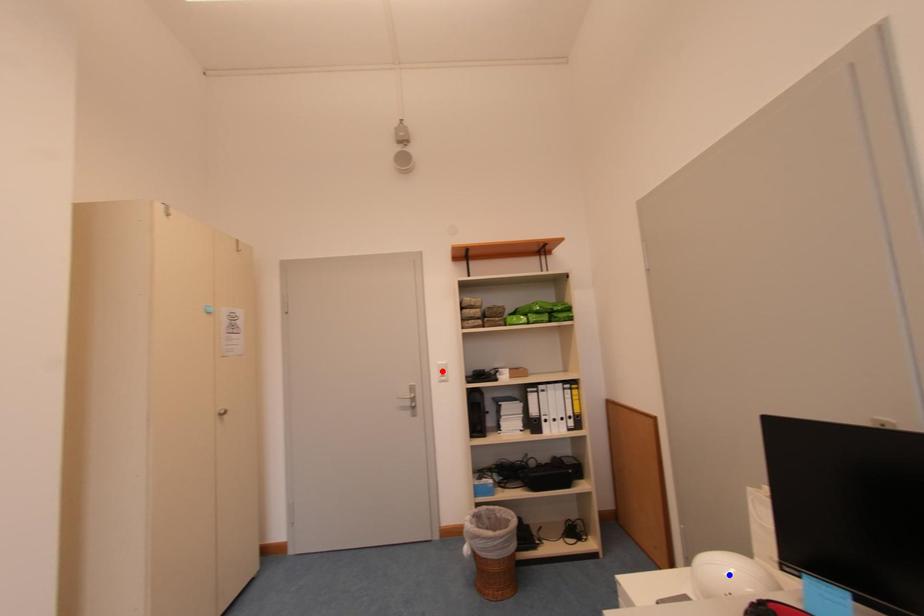
Question: Which of the two points in the image is closer to the camera?

Choices:
 (A) Blue point is closer.
 (B) Red point is closer.

Answer: (A)